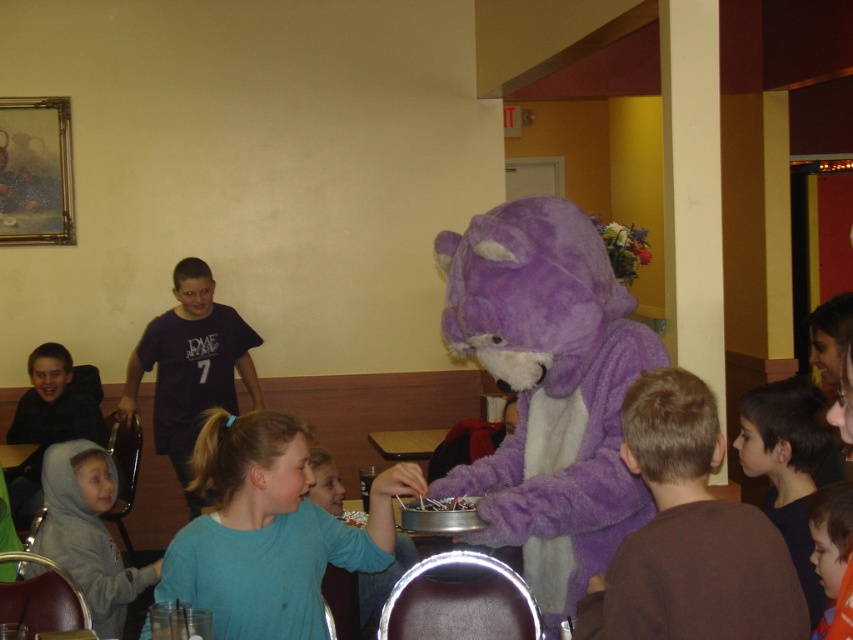
Who is taller, blue fleece shirt at center or purple fuzzy costume at center?

purple fuzzy costume at center

Between point (294, 460) and point (259, 394), which one is positioned in front?

Point (294, 460) is in front.

Where is `blue fleece shirt at center`? blue fleece shirt at center is located at coordinates [x=270, y=529].

Can you confirm if blue fleece shirt at center is positioned to the left of light blue shirt at center?

Yes, blue fleece shirt at center is to the left of light blue shirt at center.

Can you confirm if blue fleece shirt at center is smaller than light blue shirt at center?

Actually, blue fleece shirt at center might be larger than light blue shirt at center.

Is point (216, 532) closer to viewer compared to point (323, 465)?

Yes, it is.

This screenshot has height=640, width=853. In order to click on blue fleece shirt at center in this screenshot , I will do 270,529.

Is gray fleece hoodie at lower left above dark brown hair at lower right?

No, gray fleece hoodie at lower left is not above dark brown hair at lower right.

The image size is (853, 640). What do you see at coordinates (88, 531) in the screenshot?
I see `gray fleece hoodie at lower left` at bounding box center [88, 531].

The width and height of the screenshot is (853, 640). What do you see at coordinates (88, 531) in the screenshot? I see `gray fleece hoodie at lower left` at bounding box center [88, 531].

You are a GUI agent. You are given a task and a screenshot of the screen. Output one action in this format:
    pyautogui.click(x=<x>, y=<y>)
    Task: Click on the gray fleece hoodie at lower left
    
    Given the screenshot: What is the action you would take?
    pyautogui.click(x=88, y=531)